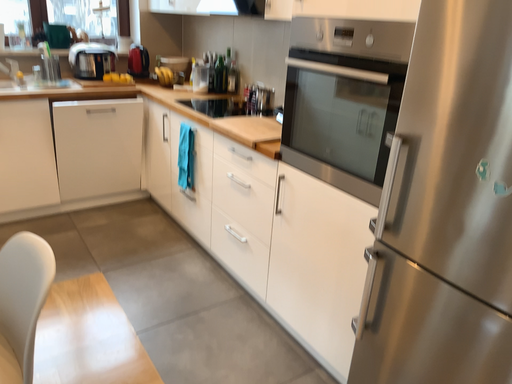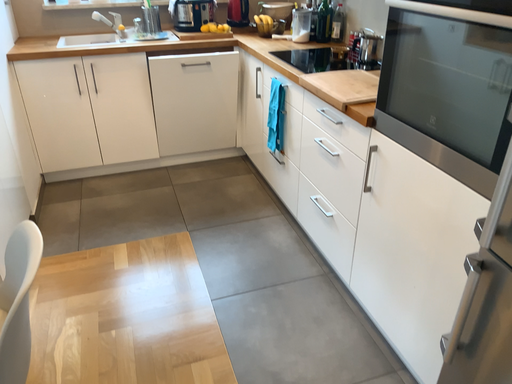
Question: Which way did the camera rotate in the video?

Choices:
 (A) rotated right
 (B) rotated left

Answer: (B)